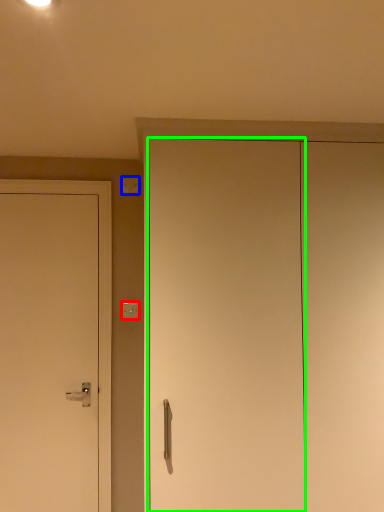
Question: Estimate the real-world distances between objects in this image. Which object is farther from light switch (highlighted by a red box), light switch (highlighted by a blue box) or door (highlighted by a green box)?

Choices:
 (A) light switch
 (B) door

Answer: (B)